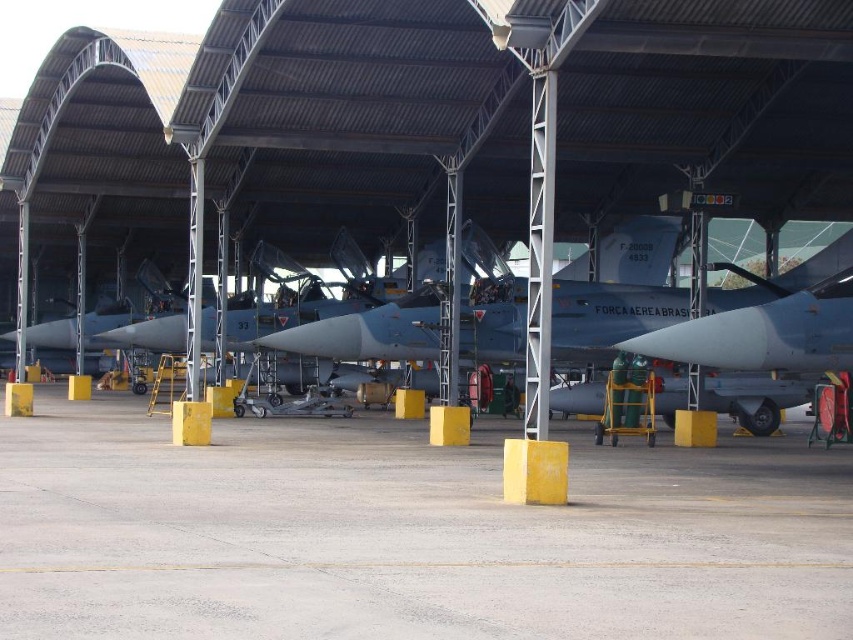
You are a maintenance crew member needing to access the matte gray jet at center. You see the gray concrete tarmac at center nearby. Which direction should you move relative to the tarmac to reach the jet?

The gray concrete tarmac at center is positioned on the left side of the matte gray jet at center, so you should move to the right relative to the tarmac to reach the matte gray jet at center.

You are standing inside the aircraft hangar and want to locate two specific points marked on the floor. The first point is at coordinates point (389, 499) and the second is at point (769, 280). Which of these two points is closer to your current position?

Point (389, 499) is closer to the camera than point (769, 280), so the first point is closer to your current position.

You are a maintenance technician in the hangar and need to access a specific point marked at coordinates point (730, 541). Your tool cart is currently 10 meters away from the camera. Can you reach the point without moving the cart more than 1 meter?

The distance of point (730, 541) from the camera is 9.10 meters. Since your tool cart is 10 meters away from the camera, moving it 1 meter towards the point would bring it to 9 meters, which is within the required distance. Therefore, you can reach the point without moving the cart more than 1 meter.